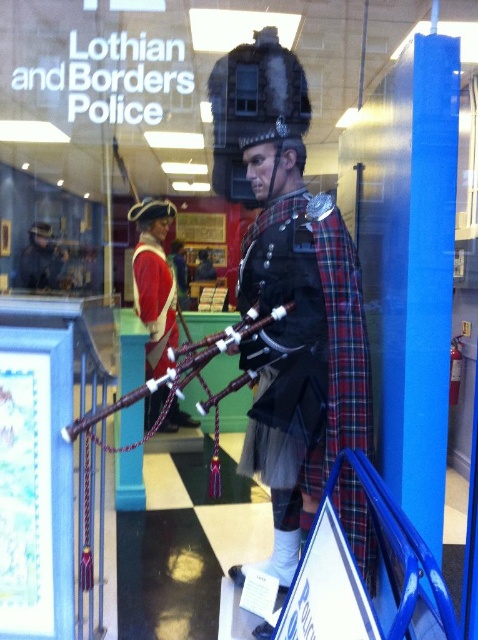
Question: Among these points, which one is farthest from the camera?

Choices:
 (A) (178, 371)
 (B) (149, 211)
 (C) (282, 445)

Answer: (B)

Question: Which object is positioned closest to the matte black kilt at center?

Choices:
 (A) wooden pipes at center
 (B) red wool uniform at center

Answer: (A)

Question: Is matte black kilt at center to the left of red wool uniform at center from the viewer's perspective?

Choices:
 (A) no
 (B) yes

Answer: (A)

Question: Which point is closer to the camera?

Choices:
 (A) wooden pipes at center
 (B) red wool uniform at center

Answer: (A)

Question: Can you confirm if matte black kilt at center is wider than wooden pipes at center?

Choices:
 (A) yes
 (B) no

Answer: (B)

Question: Can you confirm if red wool uniform at center is positioned below wooden pipes at center?

Choices:
 (A) yes
 (B) no

Answer: (B)